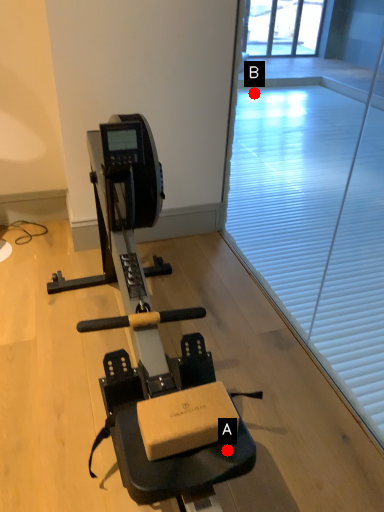
Question: Two points are circled on the image, labeled by A and B beside each circle. Which of the following is the farthest from the observer?

Choices:
 (A) A is further
 (B) B is further

Answer: (B)